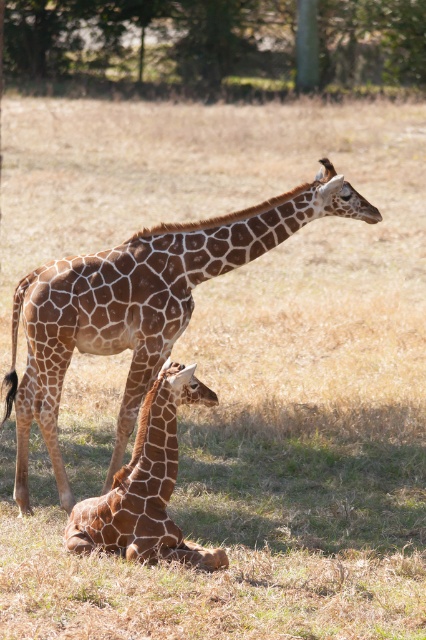
Between point (83, 316) and point (100, 497), which one is positioned in front?

Positioned in front is point (100, 497).

Can you confirm if brown spotted giraffe at center is taller than brown spotted giraffe at lower center?

Indeed, brown spotted giraffe at center has a greater height compared to brown spotted giraffe at lower center.

Which is in front, point (268, 225) or point (164, 515)?

Positioned in front is point (164, 515).

Locate an element on the screen. The width and height of the screenshot is (426, 640). brown spotted giraffe at center is located at coordinates (140, 307).

This screenshot has width=426, height=640. What do you see at coordinates (213, 45) in the screenshot?
I see `green leafy tree at upper center` at bounding box center [213, 45].

Is green leafy tree at upper center shorter than brown spotted giraffe at center?

Incorrect, green leafy tree at upper center's height does not fall short of brown spotted giraffe at center's.

Does point (316, 29) come closer to viewer compared to point (22, 412)?

That is False.

Where is `green leafy tree at upper center`? This screenshot has height=640, width=426. green leafy tree at upper center is located at coordinates (213, 45).

Who is more distant from viewer, [388,88] or [150,419]?

Point [388,88]

Is green leafy tree at upper center behind brown spotted giraffe at lower center?

Yes, it is behind brown spotted giraffe at lower center.

Who is more forward, (344, 0) or (155, 476)?

Point (155, 476) is in front.

Locate an element on the screen. This screenshot has height=640, width=426. green leafy tree at upper center is located at coordinates (213, 45).